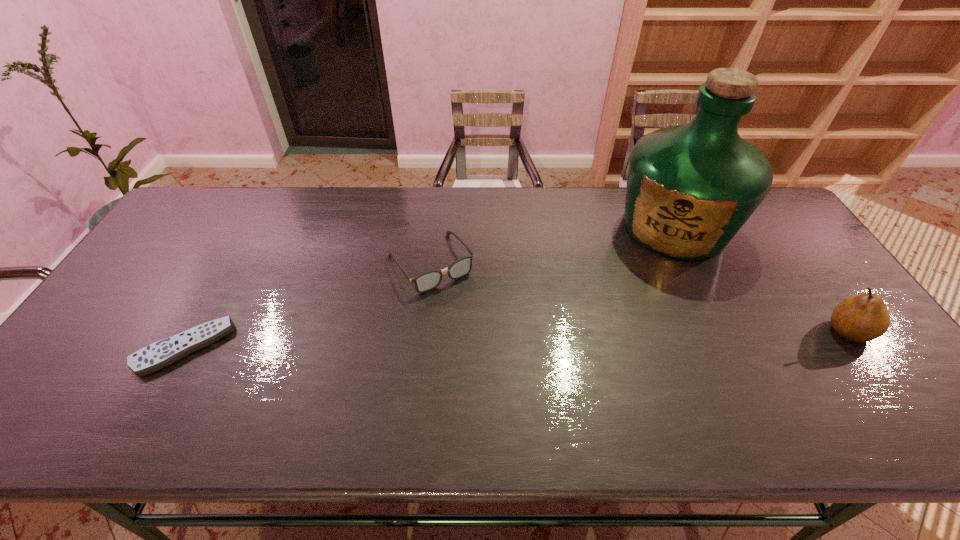
Find the location of a particular element. This screenshot has height=540, width=960. object situated at the near left corner is located at coordinates (162, 353).

I want to click on free space at the far edge, so click(533, 222).

In the image, there is a desktop. Identify the location of free space at the near edge. The width and height of the screenshot is (960, 540). (468, 388).

In the image, there is a desktop. Find the location of `vacant space at the left edge`. vacant space at the left edge is located at coordinates (156, 321).

This screenshot has height=540, width=960. What are the coordinates of `vacant space at the right edge` in the screenshot? It's located at (794, 291).

In the image, there is a desktop. Identify the location of free space at the far left corner. Image resolution: width=960 pixels, height=540 pixels. (207, 217).

Where is `vacant space at the far right corner`? vacant space at the far right corner is located at coordinates (762, 224).

Identify the location of vacant space in between the leftmost object and the spectacles. (307, 305).

Find the location of `empty location between the third shortest object and the spectacles`. empty location between the third shortest object and the spectacles is located at coordinates (639, 297).

You are a GUI agent. You are given a task and a screenshot of the screen. Output one action in this format:
    pyautogui.click(x=<x>, y=<y>)
    Task: Click on the free space that is in between the second tallest object and the tallest object
    
    Given the screenshot: What is the action you would take?
    pyautogui.click(x=761, y=279)